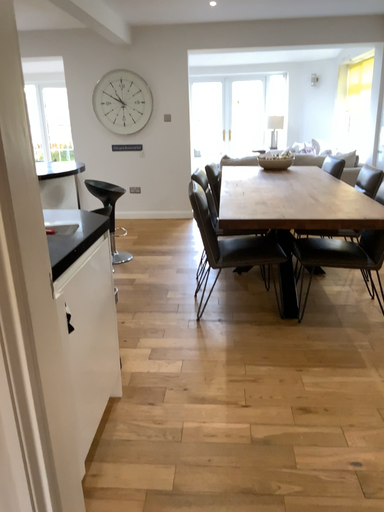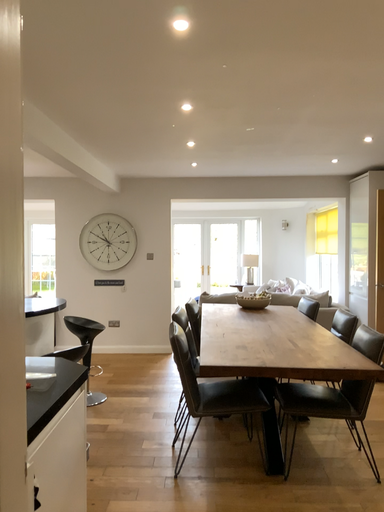
Question: Which way did the camera rotate in the video?

Choices:
 (A) rotated upward
 (B) rotated downward

Answer: (A)